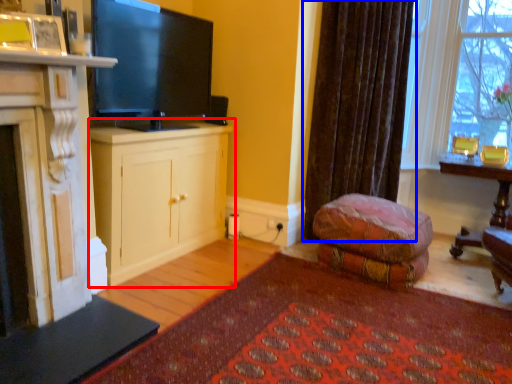
Question: Which object is further to the camera taking this photo, cabinetry (highlighted by a red box) or curtain (highlighted by a blue box)?

Choices:
 (A) cabinetry
 (B) curtain

Answer: (B)